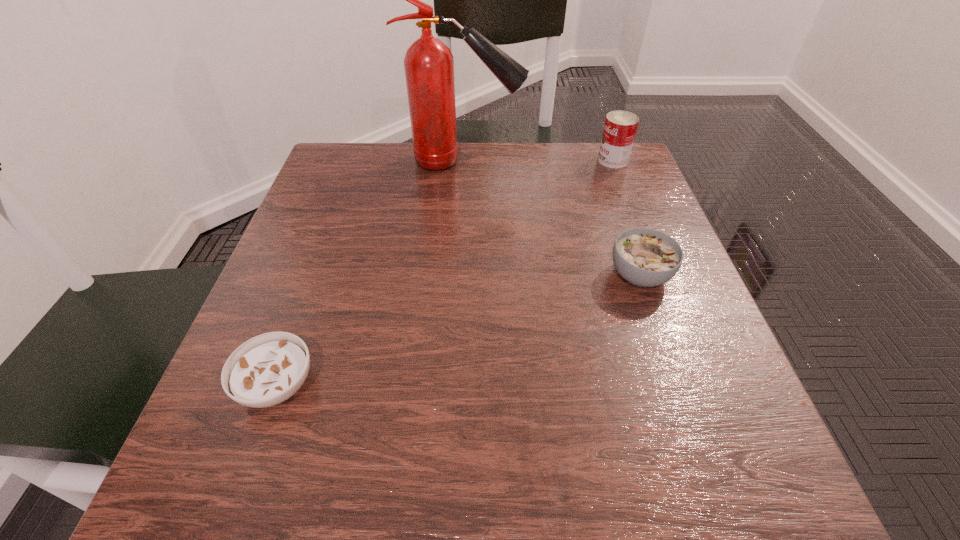
I want to click on free space at the near edge, so click(405, 500).

You are a GUI agent. You are given a task and a screenshot of the screen. Output one action in this format:
    pyautogui.click(x=<x>, y=<y>)
    Task: Click on the free region at the left edge of the desktop
    The height and width of the screenshot is (540, 960).
    Given the screenshot: What is the action you would take?
    pyautogui.click(x=318, y=256)

This screenshot has height=540, width=960. In the image, there is a desktop. In order to click on vacant region at the right edge in this screenshot , I will do `click(618, 284)`.

The height and width of the screenshot is (540, 960). I want to click on vacant point at the far left corner, so click(320, 172).

Locate an element on the screen. free area in between the can and the second nearest object is located at coordinates (626, 218).

Identify the location of free spot between the second nearest object and the second object from left to right. The image size is (960, 540). (552, 218).

The height and width of the screenshot is (540, 960). Find the location of `vacant area that lies between the second nearest object and the fire extinguisher`. vacant area that lies between the second nearest object and the fire extinguisher is located at coordinates (552, 218).

You are a GUI agent. You are given a task and a screenshot of the screen. Output one action in this format:
    pyautogui.click(x=<x>, y=<y>)
    Task: Click on the vacant area that lies between the can and the nearest object
    Image resolution: width=960 pixels, height=540 pixels.
    Given the screenshot: What is the action you would take?
    pyautogui.click(x=445, y=273)

Find the location of a particular element. The image size is (960, 540). free area in between the nearer soup bowl and the third tallest object is located at coordinates (459, 330).

At what (x,y) coordinates should I click in order to perform the action: click on empty space between the left soup bowl and the third shortest object. Please return your answer as a coordinate pair (x, y). Looking at the image, I should click on (445, 273).